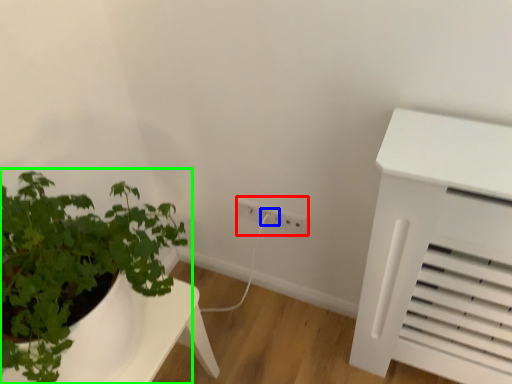
Question: Which object is positioned farthest from electric outlet (highlighted by a red box)? Select from electric outlet (highlighted by a blue box) and houseplant (highlighted by a green box).

Choices:
 (A) electric outlet
 (B) houseplant

Answer: (B)